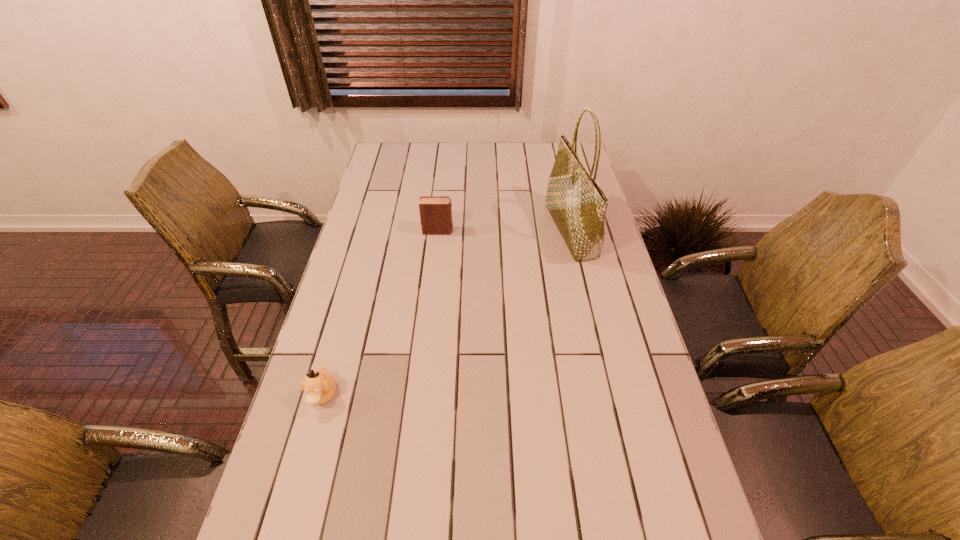
This screenshot has width=960, height=540. Identify the location of object that is at the right edge. [577, 203].

In the image, there is a desktop. Find the location of `vacant space at the far edge`. vacant space at the far edge is located at coordinates (426, 170).

At what (x,y) coordinates should I click in order to perform the action: click on vacant space at the left edge of the desktop. Please return your answer as a coordinate pair (x, y). The width and height of the screenshot is (960, 540). Looking at the image, I should click on 293,437.

You are a GUI agent. You are given a task and a screenshot of the screen. Output one action in this format:
    pyautogui.click(x=<x>, y=<y>)
    Task: Click on the free space at the right edge
    
    Given the screenshot: What is the action you would take?
    pyautogui.click(x=610, y=261)

This screenshot has height=540, width=960. Identify the location of blank space at the far left corner of the desktop. (391, 143).

At what (x,y) coordinates should I click in order to perform the action: click on free spot between the duckling and the diary. Please return your answer as a coordinate pair (x, y). Looking at the image, I should click on (380, 313).

You are a GUI agent. You are given a task and a screenshot of the screen. Output one action in this format:
    pyautogui.click(x=<x>, y=<y>)
    Task: Click on the unoccupied area between the rightmost object and the nearest object
    
    Given the screenshot: What is the action you would take?
    pyautogui.click(x=446, y=313)

I want to click on vacant space that's between the second object from left to right and the shortest object, so click(380, 313).

Where is `empty space between the shopping bag and the second tallest object`? empty space between the shopping bag and the second tallest object is located at coordinates coord(504,231).

In order to click on vacant space that's between the leftmost object and the second object from left to right in this screenshot , I will do `click(380, 313)`.